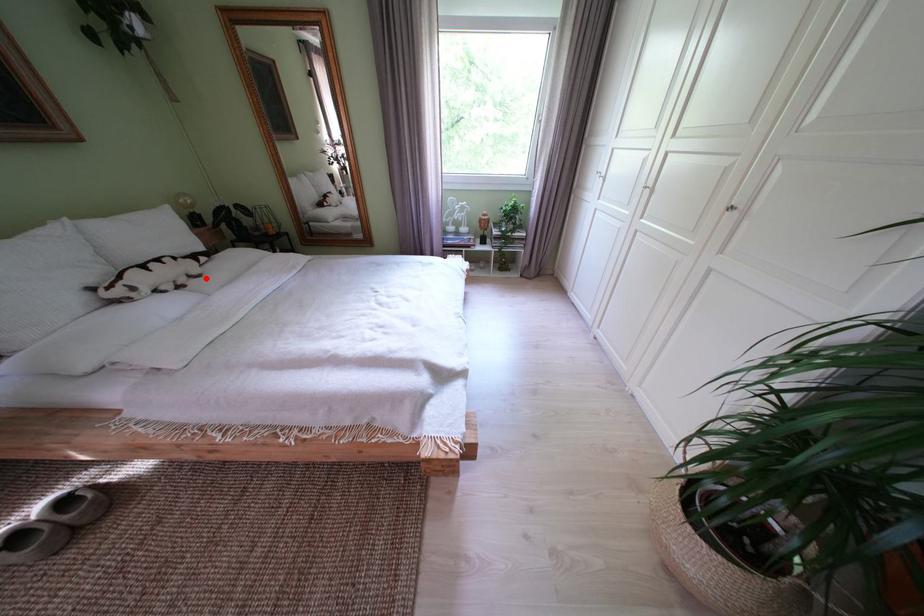
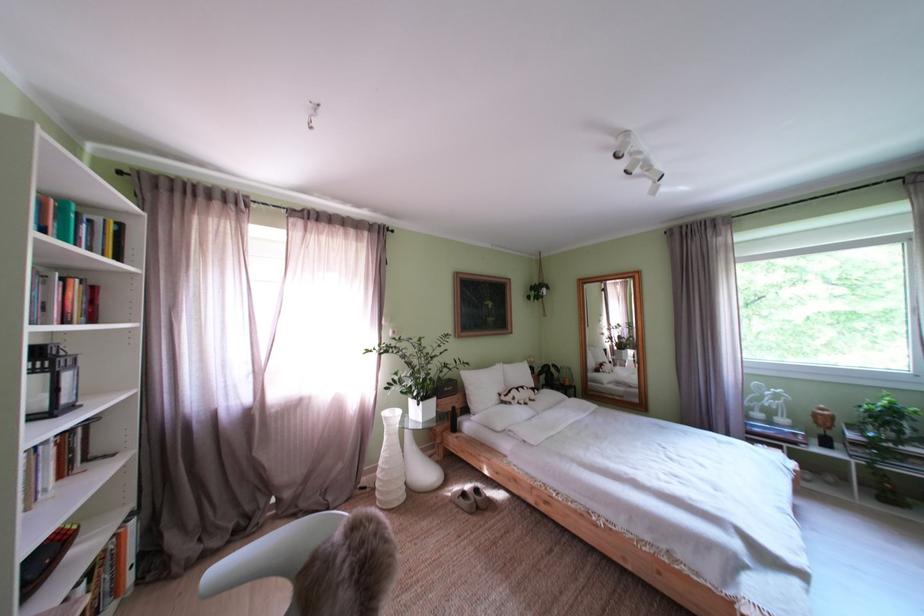
Question: I am providing you with two images of the same scene from different viewpoints. A red point is marked on the first image. Is the red point's position out of view in image 2?

Choices:
 (A) Yes
 (B) No

Answer: (B)